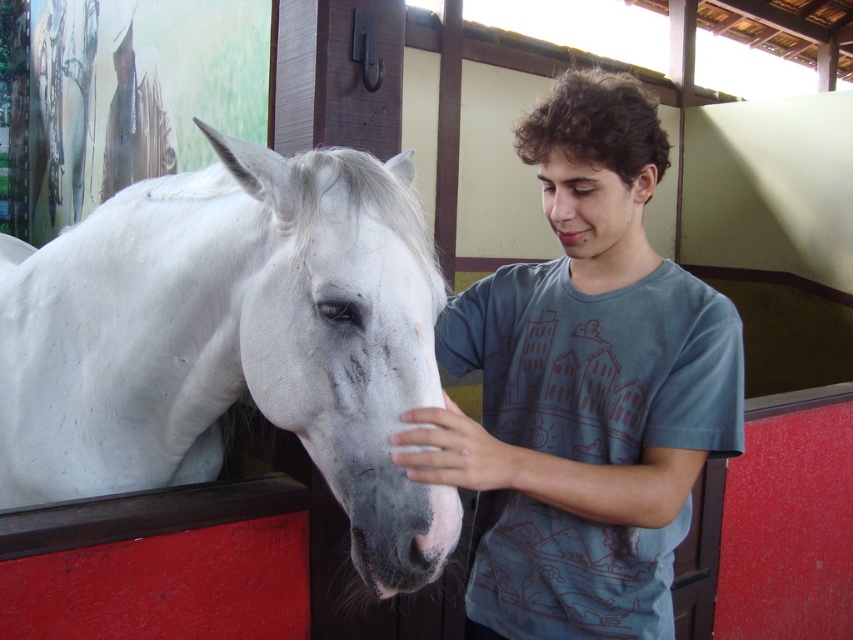
You are a painter standing in the stable and want to sketch the scene. You have a canvas that is 24 inches wide. If you want to include both the white matte horse at left and the matte skin nose at center in your painting without cropping either, will the canvas be wide enough?

The distance between the white matte horse at left and the matte skin nose at center is 26.27 inches. Since the canvas is only 24 inches wide, it is not wide enough to capture both objects without cropping.

Based on the coordinates provided in the description, where is the white matte horse at left located in the image?

The white matte horse at left is located at point coordinates of (231,340).